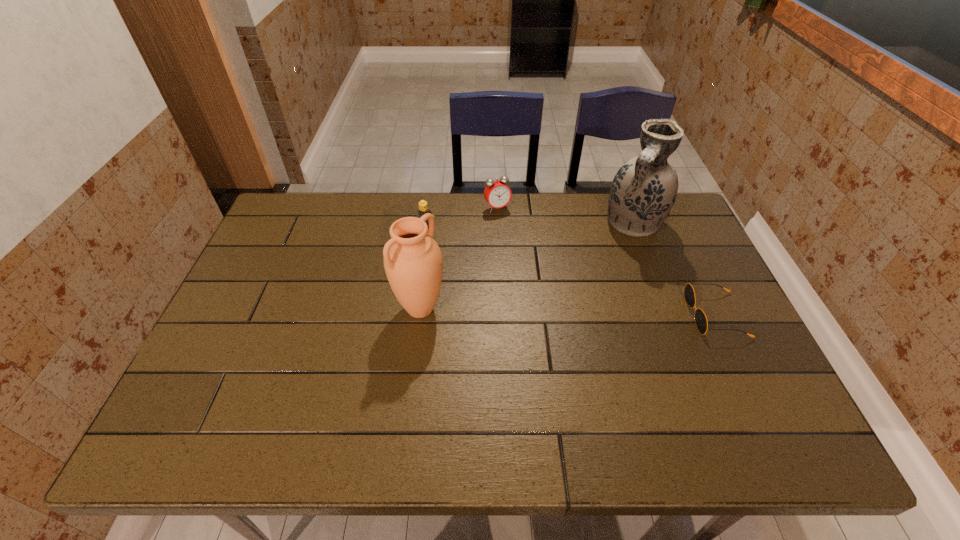
Where is `object that is the third nearest to the alarm clock`? Image resolution: width=960 pixels, height=540 pixels. object that is the third nearest to the alarm clock is located at coordinates (413, 263).

Identify the location of vacant region that satisfies the following two spatial constraints: 1. on the back side of the Lego; 2. on the right side of the alarm clock. (430, 208).

In order to click on free space that satisfies the following two spatial constraints: 1. on the front side of the alarm clock; 2. on the right side of the vase in this screenshot , I will do `click(498, 223)`.

Where is `free spot that satisfies the following two spatial constraints: 1. on the back side of the alarm clock; 2. on the right side of the Lego`? free spot that satisfies the following two spatial constraints: 1. on the back side of the alarm clock; 2. on the right side of the Lego is located at coordinates (430, 208).

I want to click on vacant space that satisfies the following two spatial constraints: 1. on the front side of the second tallest object; 2. on the front-facing side of the shortest object, so pyautogui.click(x=420, y=315).